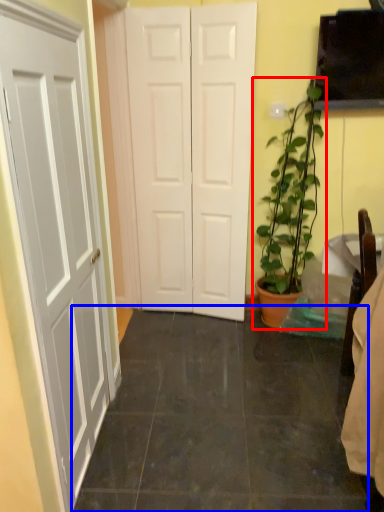
Question: Which object appears farthest to the camera in this image, houseplant (highlighted by a red box) or tile (highlighted by a blue box)?

Choices:
 (A) houseplant
 (B) tile

Answer: (A)